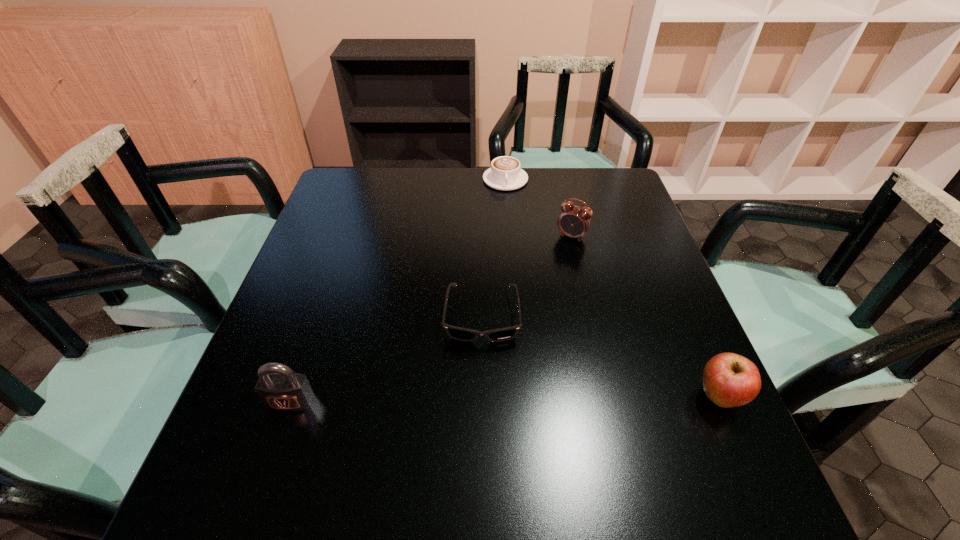
Locate an element on the screen. The image size is (960, 540). object that is the fourth closest to the second farthest object is located at coordinates (283, 390).

Where is `vacant area that satisfies the following two spatial constraints: 1. on the front side of the alarm clock; 2. on the left side of the cappuccino`? Image resolution: width=960 pixels, height=540 pixels. vacant area that satisfies the following two spatial constraints: 1. on the front side of the alarm clock; 2. on the left side of the cappuccino is located at coordinates (510, 236).

Locate an element on the screen. The height and width of the screenshot is (540, 960). vacant position in the image that satisfies the following two spatial constraints: 1. on the front side of the apple; 2. on the left side of the farthest object is located at coordinates (522, 396).

Identify the location of free region that satisfies the following two spatial constraints: 1. on the back side of the alarm clock; 2. on the left side of the sunglasses. (481, 236).